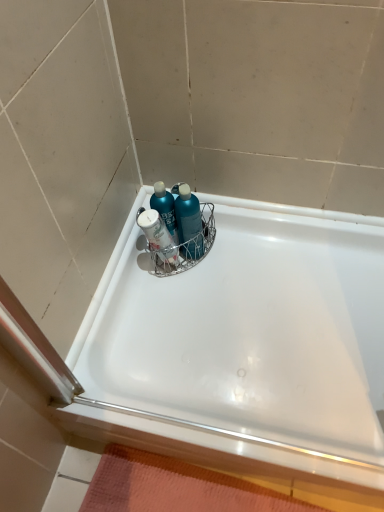
The image size is (384, 512). Identify the location of vacant space in front of teal glossy shampoo at center, which is the first cleaning product from left to right. (177, 292).